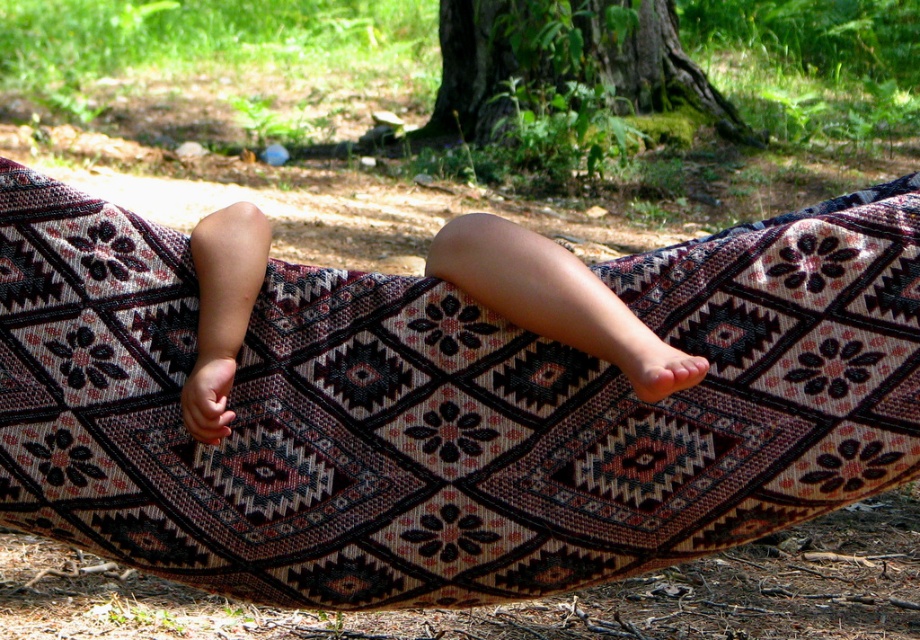
Between point (420, 477) and point (508, 317), which one is positioned behind?

The point (508, 317) is more distant.

Between patterned fabric hammock at center and smooth skin legs at center, which one has more height?

patterned fabric hammock at center

Describe the element at coordinates (446, 408) in the screenshot. I see `patterned fabric hammock at center` at that location.

Identify the location of patterned fabric hammock at center. The image size is (920, 640). (446, 408).

Who is positioned more to the left, patterned fabric hammock at center or green mossy bark at center?

From the viewer's perspective, patterned fabric hammock at center appears more on the left side.

Does patterned fabric hammock at center have a greater height compared to green mossy bark at center?

No, patterned fabric hammock at center is not taller than green mossy bark at center.

This screenshot has height=640, width=920. I want to click on patterned fabric hammock at center, so click(446, 408).

The image size is (920, 640). I want to click on patterned fabric hammock at center, so click(446, 408).

Based on the photo, between smooth skin legs at center and green mossy bark at center, which one is positioned higher?

green mossy bark at center is above.

Looking at this image, is smooth skin legs at center wider than green mossy bark at center?

No.

Which is in front, point (215, 410) or point (719, 132)?

Point (215, 410)

The image size is (920, 640). In order to click on smooth skin legs at center in this screenshot , I will do `click(555, 300)`.